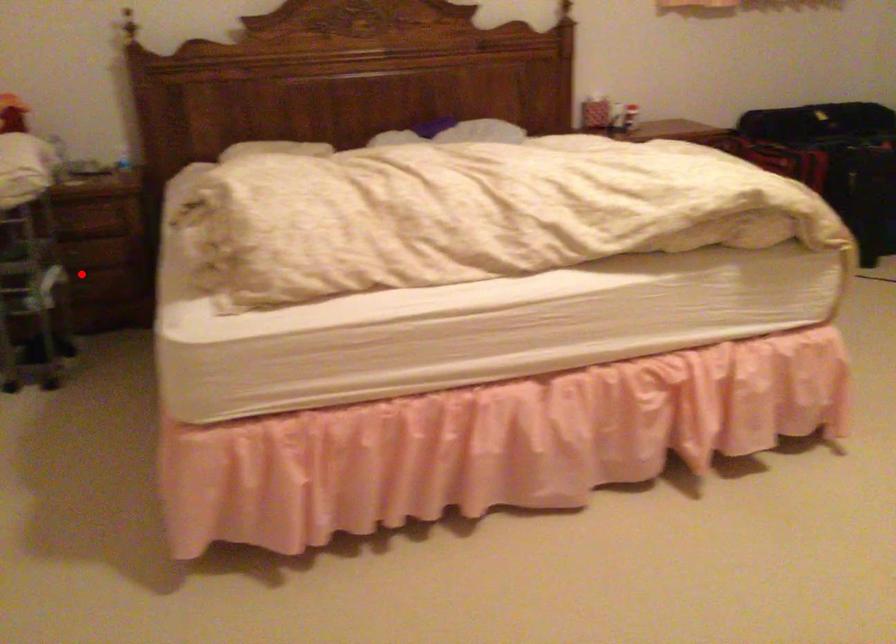
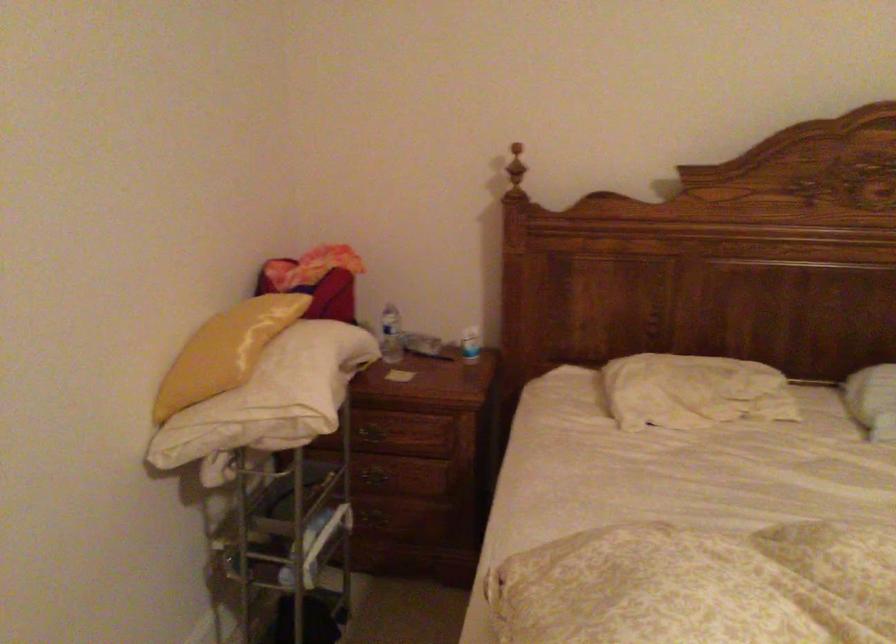
The point at the highlighted location is marked in the first image. Where is the corresponding point in the second image?

(381, 516)